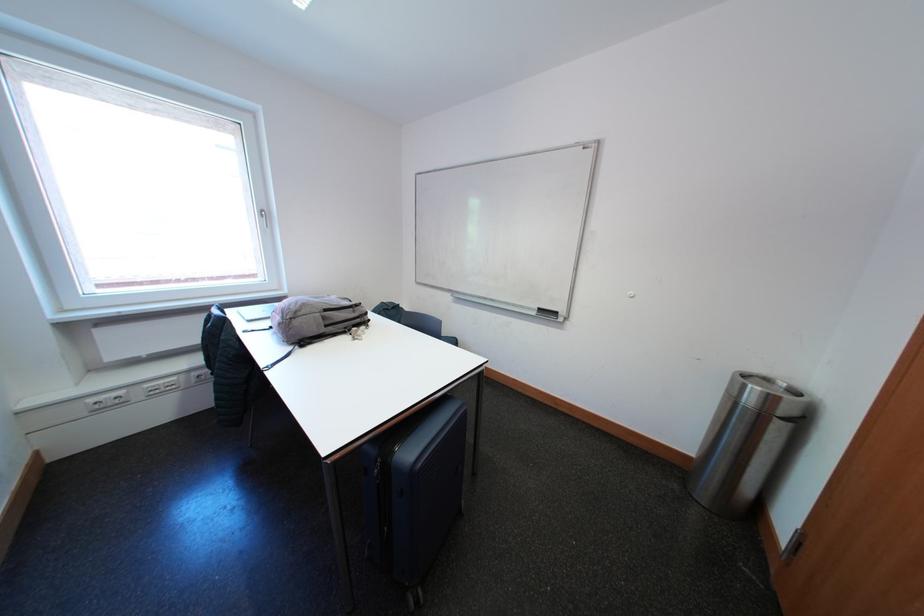
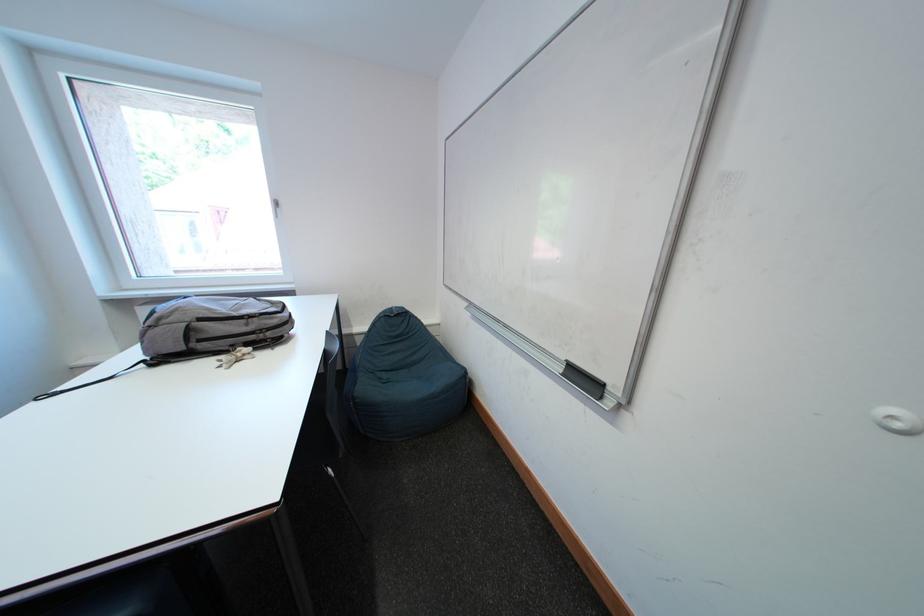
In the second image, find the point that corresponds to pixel 355 331 in the first image.

(241, 349)